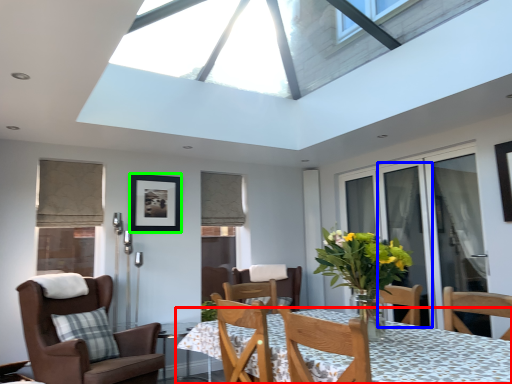
Question: Which object is positioned farthest from table (highlighted by a red box)? Select from screen door (highlighted by a blue box) and picture frame (highlighted by a green box).

Choices:
 (A) screen door
 (B) picture frame

Answer: (B)